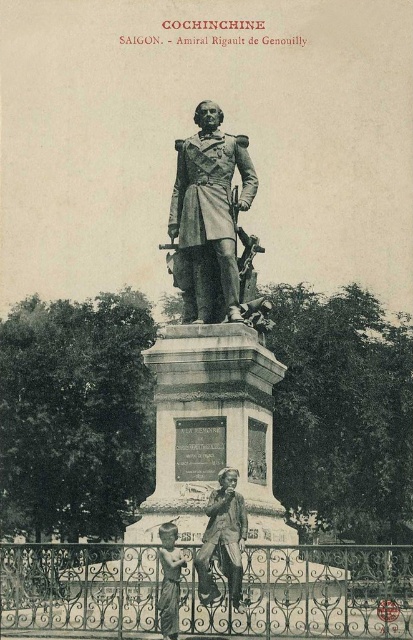
Question: Which point is closer to the camera taking this photo?

Choices:
 (A) (282, 612)
 (B) (189, 170)

Answer: (A)

Question: Is wrought iron fence at lower center in front of matte bronze statue at lower center?

Choices:
 (A) yes
 (B) no

Answer: (B)

Question: Considering the real-world distances, which object is farthest from the bronze statue at center?

Choices:
 (A) wrought iron fence at lower center
 (B) matte bronze statue at lower center

Answer: (B)

Question: Is bronze statue at center further to the viewer compared to matte bronze statue at center?

Choices:
 (A) no
 (B) yes

Answer: (B)

Question: Which object appears farthest from the camera in this image?

Choices:
 (A) bronze statue at center
 (B) wrought iron fence at lower center
 (C) matte bronze statue at lower center

Answer: (A)

Question: Can you confirm if wrought iron fence at lower center is wider than matte bronze statue at lower center?

Choices:
 (A) yes
 (B) no

Answer: (A)